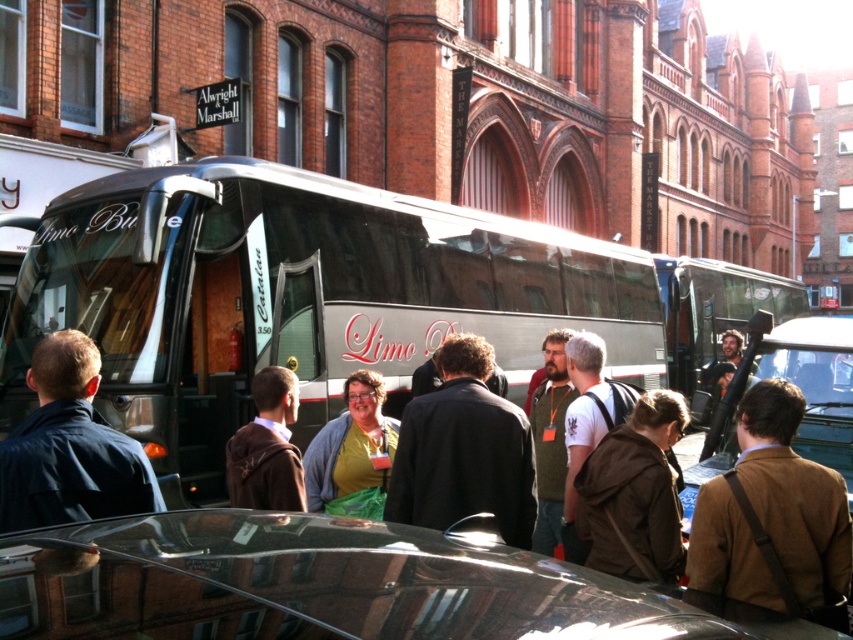
Question: Based on their relative distances, which object is nearer to the yellow matte shirt at center?

Choices:
 (A) shiny silver bus at center
 (B) brown fuzzy jacket at center

Answer: (B)

Question: From the image, what is the correct spatial relationship of shiny silver bus at center in relation to brown leather jacket at center?

Choices:
 (A) below
 (B) above

Answer: (B)

Question: Which of the following is the farthest from the observer?

Choices:
 (A) white t-shirt with graphic at center
 (B) shiny silver bus at center
 (C) yellow matte shirt at center
 (D) brown fuzzy jacket at center

Answer: (C)

Question: Does matte yellow shirt at center appear on the left side of brown leather jacket at center?

Choices:
 (A) yes
 (B) no

Answer: (A)

Question: Which of the following is the closest to the observer?

Choices:
 (A) dark blue jacket at left
 (B) shiny silver bus at center
 (C) brown wool jacket at center
 (D) brown leather jacket at center

Answer: (A)

Question: Does brown wool jacket at center have a larger size compared to dark blue jacket at left?

Choices:
 (A) no
 (B) yes

Answer: (B)